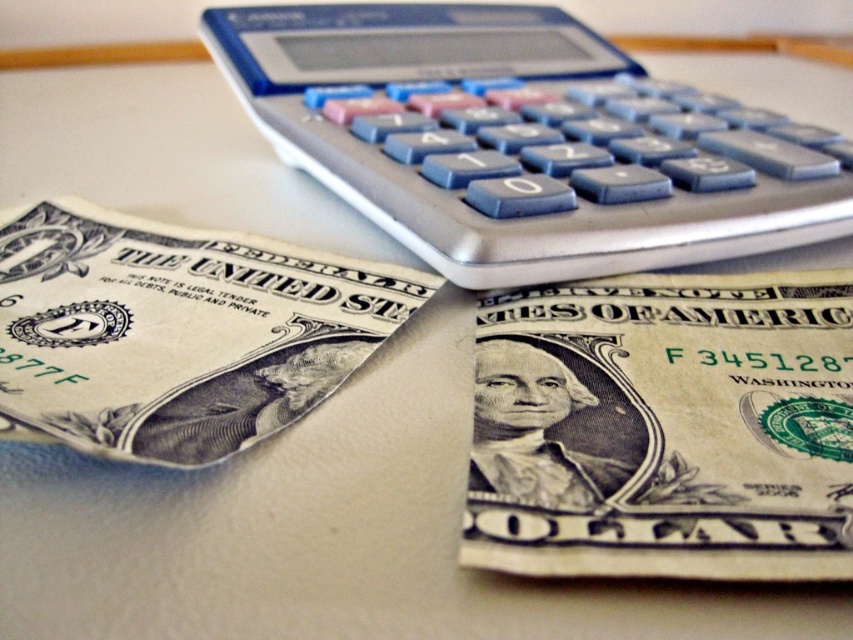
Question: Can you confirm if beige paper money at center is positioned above gray paper currency at center?

Choices:
 (A) yes
 (B) no

Answer: (B)

Question: Does beige paper money at center have a larger size compared to gray paper currency at center?

Choices:
 (A) yes
 (B) no

Answer: (B)

Question: Which is nearer to the beige paper money at center?

Choices:
 (A) silver/blue plastic calculator at upper center
 (B) gray paper currency at center

Answer: (B)

Question: Considering the real-world distances, which object is farthest from the silver/blue plastic calculator at upper center?

Choices:
 (A) gray paper currency at center
 (B) beige paper money at center

Answer: (A)

Question: Which point is closer to the camera taking this photo?

Choices:
 (A) (494, 88)
 (B) (218, 362)
 (C) (801, 316)

Answer: (B)

Question: Is beige paper money at center to the right of gray paper currency at center from the viewer's perspective?

Choices:
 (A) no
 (B) yes

Answer: (B)